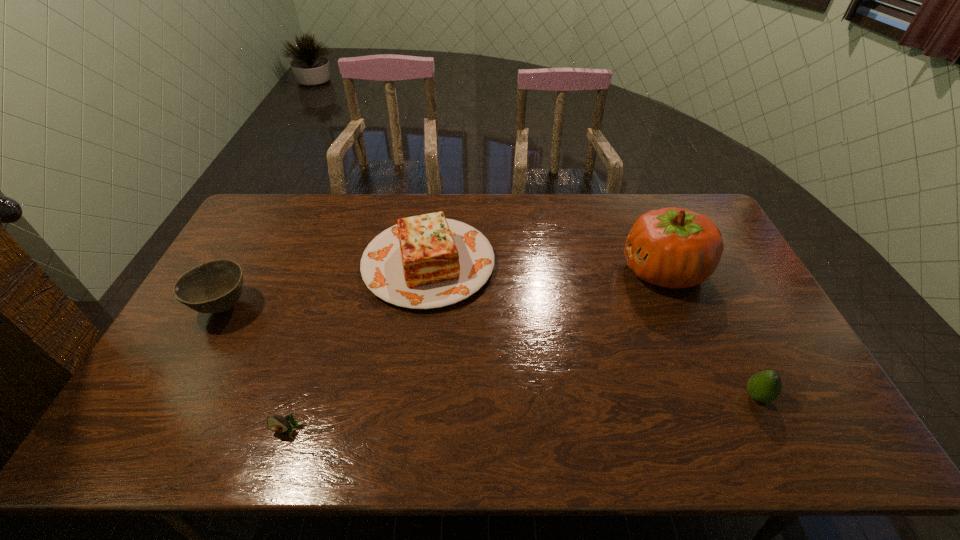
The width and height of the screenshot is (960, 540). What are the coordinates of `vacant space located 0.250m on the right of the third object from right to left` in the screenshot? It's located at (571, 264).

What are the coordinates of `vacant space located 0.340m on the front of the bowl` in the screenshot? It's located at (148, 449).

Image resolution: width=960 pixels, height=540 pixels. Find the location of `vacant space located on the front of the taller avocado`. vacant space located on the front of the taller avocado is located at coordinates (777, 436).

At what (x,y) coordinates should I click in order to perform the action: click on object positioned at the far edge. Please return your answer as a coordinate pair (x, y). This screenshot has width=960, height=540. Looking at the image, I should click on (427, 261).

At what (x,y) coordinates should I click in order to perform the action: click on object that is at the near edge. Please return your answer as a coordinate pair (x, y). The image size is (960, 540). Looking at the image, I should click on (275, 423).

Find the location of a particular element. This screenshot has width=960, height=540. object that is at the left edge is located at coordinates point(215,286).

This screenshot has width=960, height=540. What are the coordinates of `pumpkin present at the right edge` in the screenshot? It's located at (675, 248).

Where is `avocado located at the right edge`? avocado located at the right edge is located at coordinates (765, 386).

The width and height of the screenshot is (960, 540). In the image, there is a desktop. Identify the location of free region at the far edge. (567, 227).

Find the location of `vacant space at the near edge of the desktop`. vacant space at the near edge of the desktop is located at coordinates (719, 455).